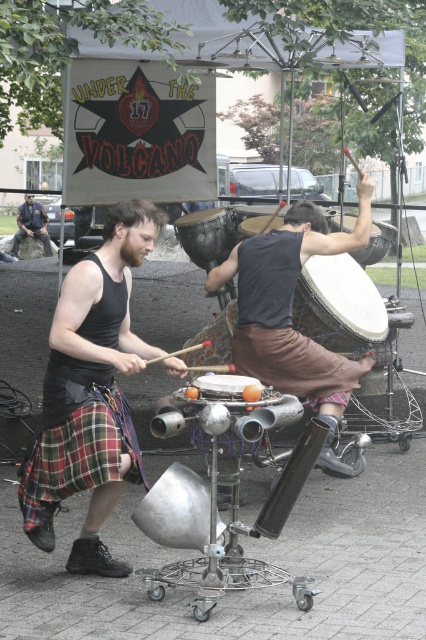
Does point (58, 461) come closer to viewer compared to point (28, 205)?

Yes, it is in front of point (28, 205).

Does plaid fabric kilt at lower left appear under black leather jacket at left?

Yes, plaid fabric kilt at lower left is below black leather jacket at left.

Locate an element on the screen. plaid fabric kilt at lower left is located at coordinates (80, 452).

Find the location of `plaid fabric kilt at lower left`. plaid fabric kilt at lower left is located at coordinates (80, 452).

Can you confirm if black drum at center is shorter than matte black drum at center?

Incorrect, black drum at center's height does not fall short of matte black drum at center's.

Between black drum at center and matte black drum at center, which one has less height?

Standing shorter between the two is matte black drum at center.

Is point (235, 216) closer to viewer compared to point (253, 221)?

No, (235, 216) is further to viewer.

Where is `black drum at center`? The height and width of the screenshot is (640, 426). black drum at center is located at coordinates (207, 236).

Can you confirm if black drum at center is bigger than black leather jacket at left?

No.

What do you see at coordinates (207, 236) in the screenshot? I see `black drum at center` at bounding box center [207, 236].

Image resolution: width=426 pixels, height=640 pixels. In order to click on black drum at center in this screenshot , I will do `click(207, 236)`.